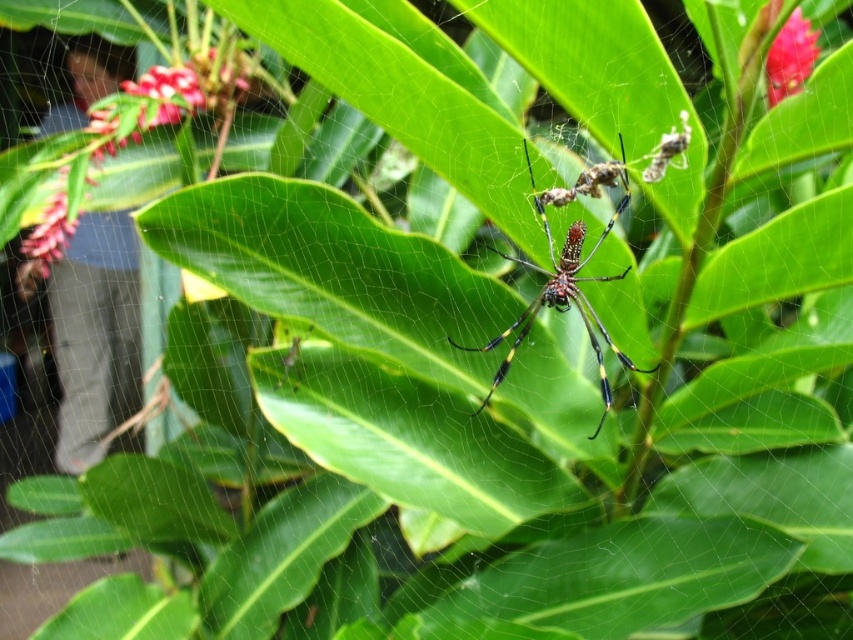
Between point (515, 340) and point (776, 10), which one is positioned in front?

Point (776, 10) is more forward.

Where is `shiny metallic spider at center`? The width and height of the screenshot is (853, 640). shiny metallic spider at center is located at coordinates (564, 291).

Where is `shiny metallic spider at center`? This screenshot has height=640, width=853. shiny metallic spider at center is located at coordinates (564, 291).

Does glossy pink flower at upper left have a lesser width compared to glossy pink flower at upper right?

No, glossy pink flower at upper left is not thinner than glossy pink flower at upper right.

Find the location of a particular element. The height and width of the screenshot is (640, 853). glossy pink flower at upper left is located at coordinates (173, 83).

Is glossy pink flower at upper left smaller than shiny metallic spider at center?

Incorrect, glossy pink flower at upper left is not smaller in size than shiny metallic spider at center.

Between glossy pink flower at upper left and shiny metallic spider at center, which one is positioned higher?

glossy pink flower at upper left

The width and height of the screenshot is (853, 640). Find the location of `glossy pink flower at upper left`. glossy pink flower at upper left is located at coordinates point(173,83).